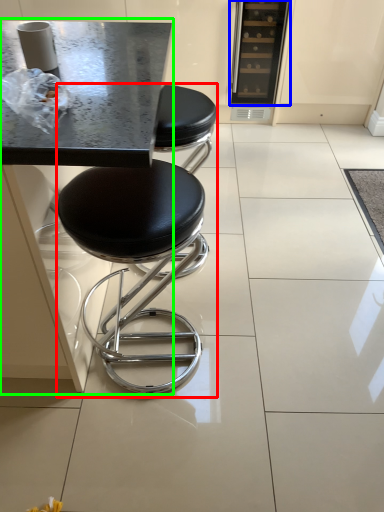
Question: Which is nearer to the stool (highlighted by a red box)? appliance (highlighted by a blue box) or round table (highlighted by a green box).

Choices:
 (A) appliance
 (B) round table

Answer: (B)